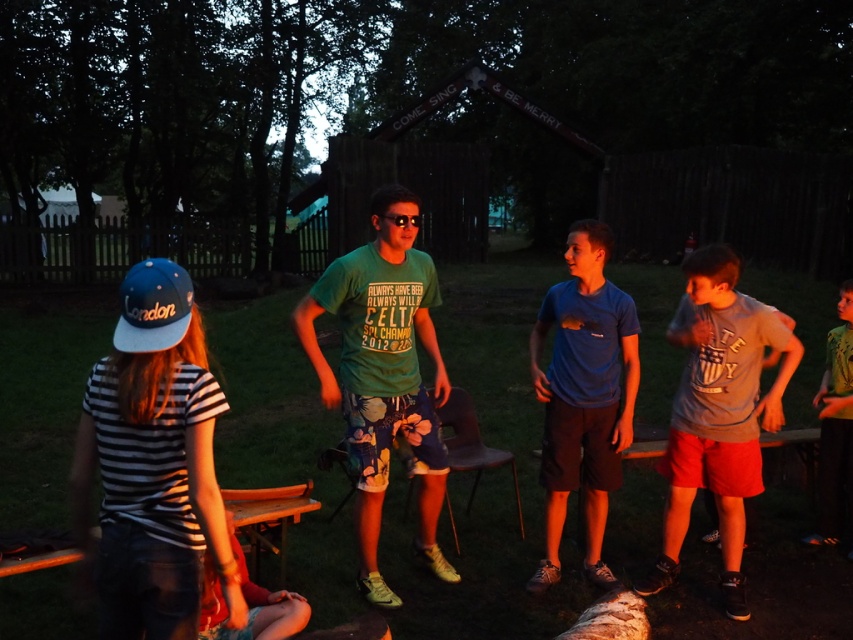
You are standing at the point labeled point [439,369] and want to walk towards the point labeled point [601,419]. Which direction should you face to move directly towards it?

You should face backward because point [439,369] is in front of point [601,419], so moving towards it would require facing away from your current position.